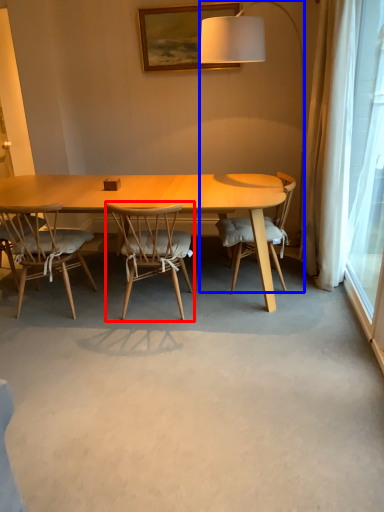
Question: Which object appears farthest to the camera in this image, chair (highlighted by a red box) or lamp (highlighted by a blue box)?

Choices:
 (A) chair
 (B) lamp

Answer: (B)